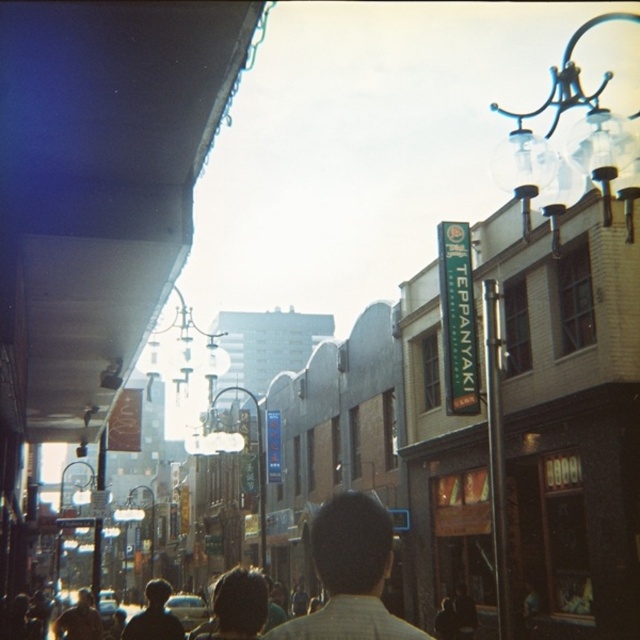
Question: Can you confirm if light brown shirt at center is thinner than dark brown hair at center?

Choices:
 (A) no
 (B) yes

Answer: (B)

Question: In this image, where is light brown shirt at center located relative to dark brown hair at center?

Choices:
 (A) above
 (B) below

Answer: (A)

Question: Which object is farther from the camera taking this photo?

Choices:
 (A) dark brown hair at center
 (B) light brown shirt at center

Answer: (A)

Question: Does light brown shirt at center have a smaller size compared to dark brown hair at center?

Choices:
 (A) yes
 (B) no

Answer: (A)